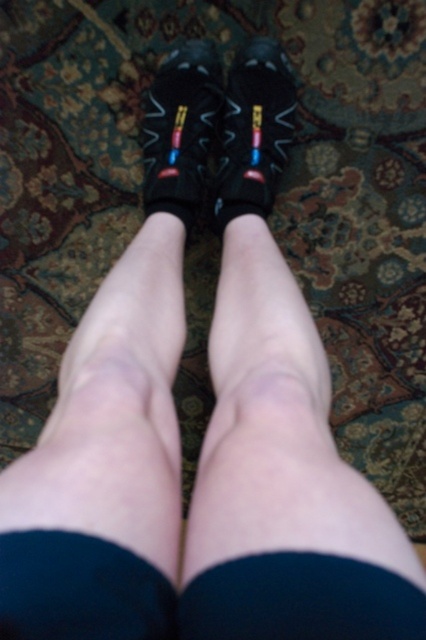
Question: Can you confirm if black matte sock at lower center is smaller than matte black slipper at center?

Choices:
 (A) no
 (B) yes

Answer: (B)

Question: Can you confirm if black matte sock at center is positioned below matte black shoe at center?

Choices:
 (A) yes
 (B) no

Answer: (A)

Question: Which object is the closest to the black matte sock at lower center?

Choices:
 (A) black matte sock at center
 (B) matte black slipper at center

Answer: (A)

Question: Which object is positioned farthest from the black matte sock at lower center?

Choices:
 (A) matte black shoe at center
 (B) matte black slipper at center

Answer: (A)

Question: Which object appears farthest from the camera in this image?

Choices:
 (A) black matte sock at lower center
 (B) matte black shoe at center

Answer: (B)

Question: Can you confirm if black matte sock at center is thinner than black matte sock at lower center?

Choices:
 (A) no
 (B) yes

Answer: (A)